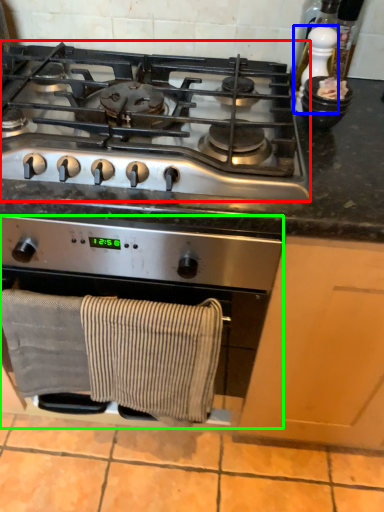
Question: Which is farther away from gas stove (highlighted by a red box)? appliance (highlighted by a blue box) or kitchen appliance (highlighted by a green box)?

Choices:
 (A) appliance
 (B) kitchen appliance

Answer: (A)